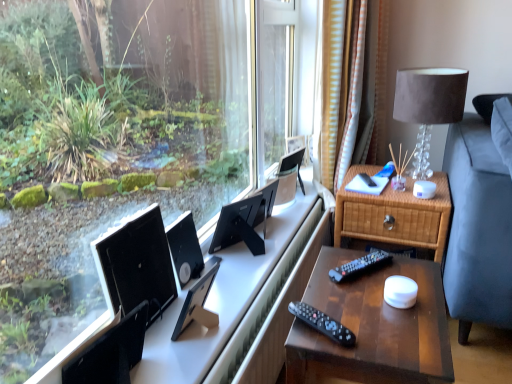
This screenshot has width=512, height=384. In order to click on vacant area that lies in front of black plastic remote control at lower center, acting as the 2th remote control starting from the front in this screenshot , I will do `click(375, 305)`.